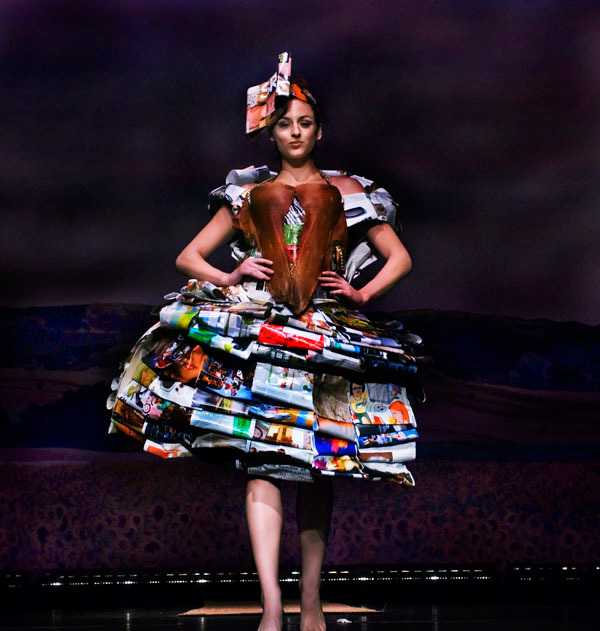
Find the location of a particular element. This screenshot has height=631, width=600. tan floor is located at coordinates (237, 604).